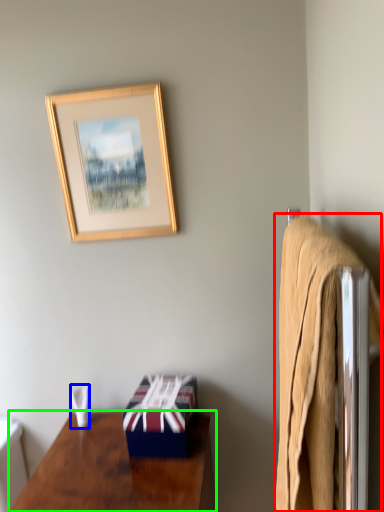
Question: Which is nearer to the bath towel (highlighted by a red box)? towel/napkin (highlighted by a blue box) or desk (highlighted by a green box).

Choices:
 (A) towel/napkin
 (B) desk

Answer: (B)